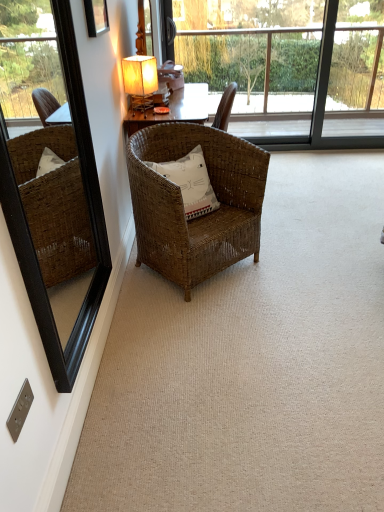
Question: In the image, is transparent glass bay window at upper center positioned in front of or behind white cotton pillow at center?

Choices:
 (A) behind
 (B) front

Answer: (A)

Question: Does point [327, 64] appear closer or farther from the camera than point [193, 203]?

Choices:
 (A) farther
 (B) closer

Answer: (A)

Question: Which object is the closest to the black wood mirror at left?

Choices:
 (A) wooden picture frame at upper left
 (B) woven brown chair at center
 (C) transparent glass bay window at upper center
 (D) matte beige fabric table lamp at upper center
 (E) white cotton pillow at center

Answer: (B)

Question: Estimate the real-world distances between objects in this image. Which object is closer to the matte beige fabric table lamp at upper center?

Choices:
 (A) white cotton pillow at center
 (B) wooden picture frame at upper left
 (C) black wood mirror at left
 (D) woven brown chair at center
 (E) transparent glass bay window at upper center

Answer: (B)